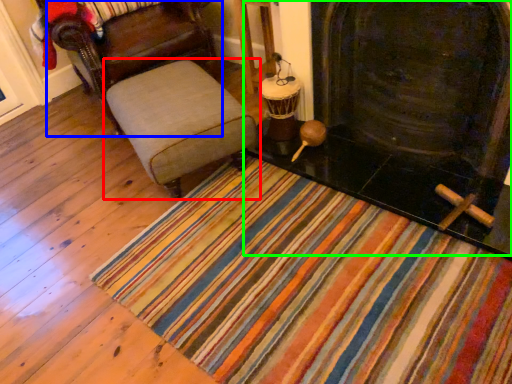
Question: Which is farther away from furniture (highlighted by a red box)? chair (highlighted by a blue box) or fireplace (highlighted by a green box)?

Choices:
 (A) chair
 (B) fireplace

Answer: (B)